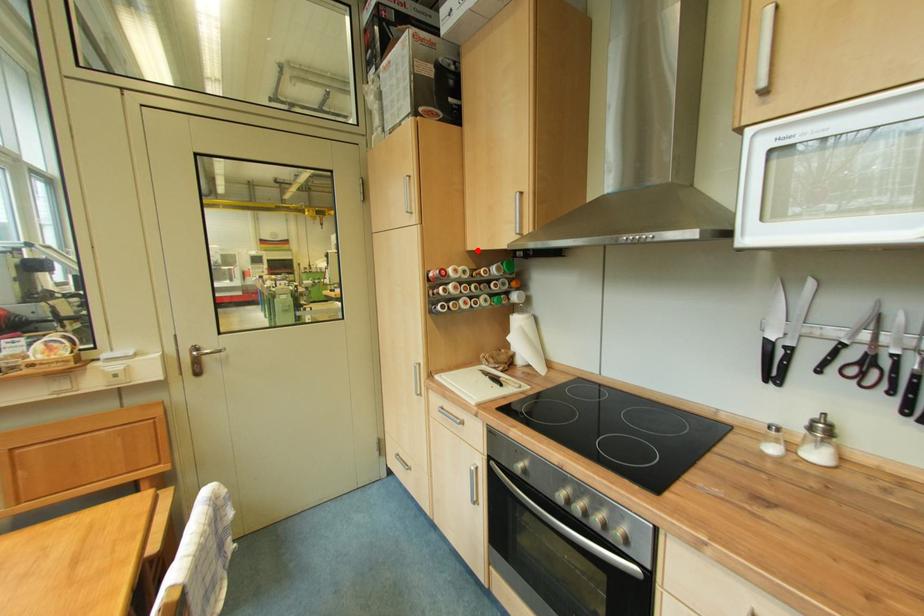
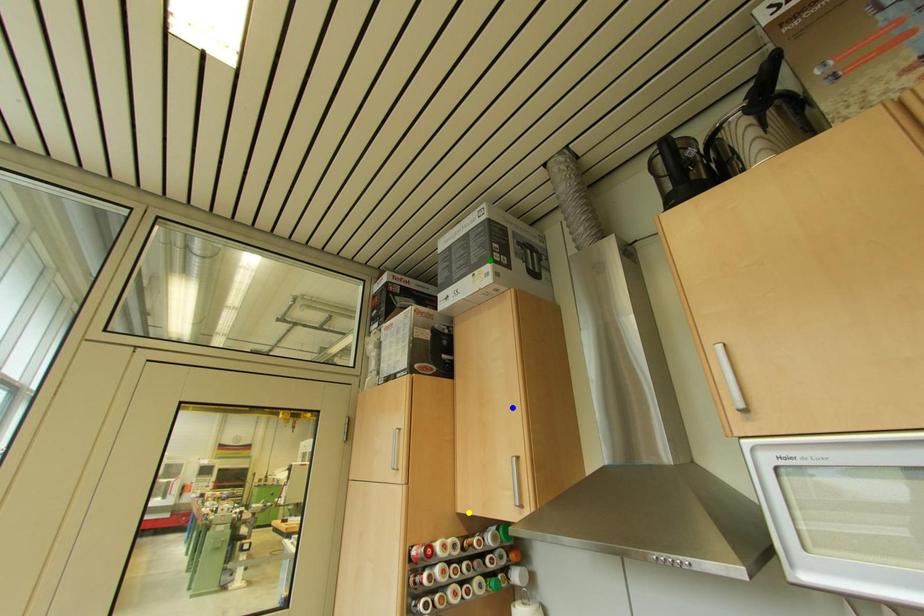
Question: I am providing you with two images of the same scene from different viewpoints. A red point is marked on the first image. You are given multiple points on the second image. Which spot in image 2 lines up with the point in image 1?

Choices:
 (A) blue point
 (B) yellow point
 (C) green point

Answer: (B)